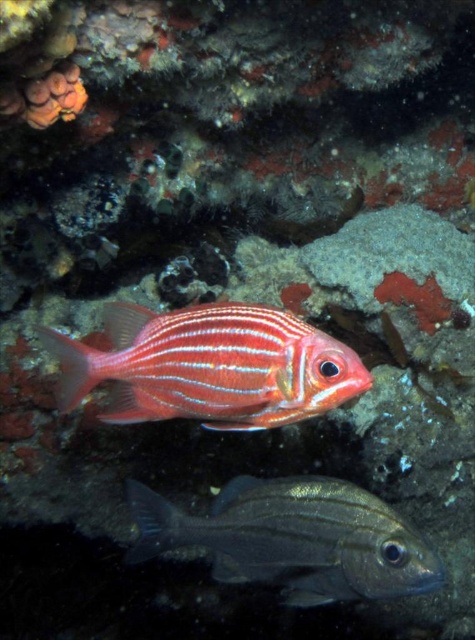
Question: In this image, where is shiny red fish at center located relative to shiny silver fish at center?

Choices:
 (A) above
 (B) below

Answer: (A)

Question: Which point is farther to the camera?

Choices:
 (A) (312, 504)
 (B) (246, 337)

Answer: (A)

Question: Can you confirm if shiny red fish at center is positioned above shiny silver fish at center?

Choices:
 (A) no
 (B) yes

Answer: (B)

Question: Can you confirm if shiny red fish at center is bigger than shiny silver fish at center?

Choices:
 (A) no
 (B) yes

Answer: (A)

Question: Which point appears closest to the camera in this image?

Choices:
 (A) (313, 349)
 (B) (142, 525)

Answer: (A)